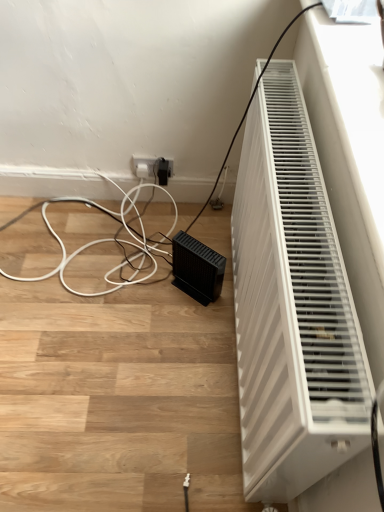
Where is `vacant point above white plastic radiator at right (from a real-world perspective)`? Image resolution: width=384 pixels, height=512 pixels. vacant point above white plastic radiator at right (from a real-world perspective) is located at coordinates (295, 182).